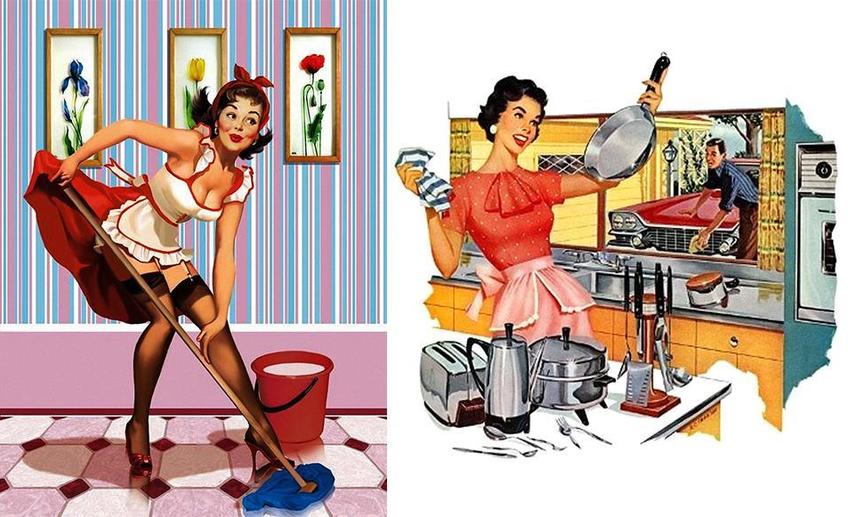
Where is `pictures on wall`? This screenshot has height=517, width=848. pictures on wall is located at coordinates (68, 76), (192, 66), (313, 83).